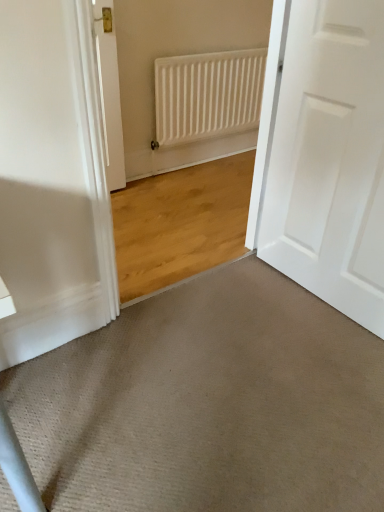
Identify the location of free point above beige carpet at lower center (from a real-world perspective). (211, 390).